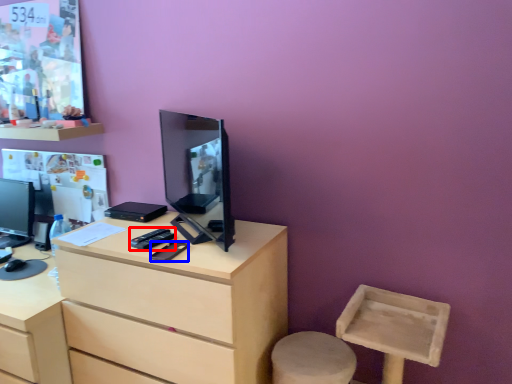
Question: Among these objects, which one is farthest to the camera, remote control (highlighted by a red box) or mobile phone (highlighted by a blue box)?

Choices:
 (A) remote control
 (B) mobile phone

Answer: (A)